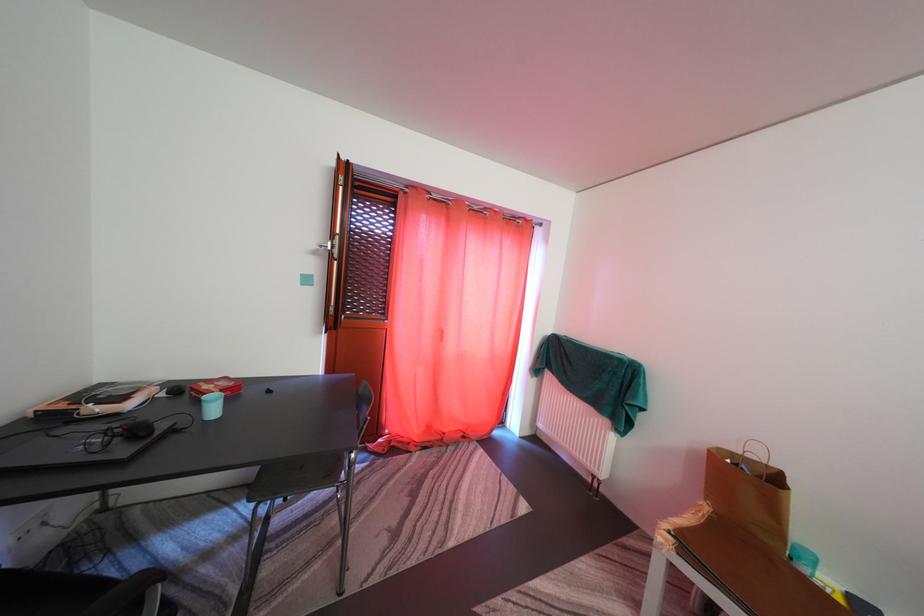
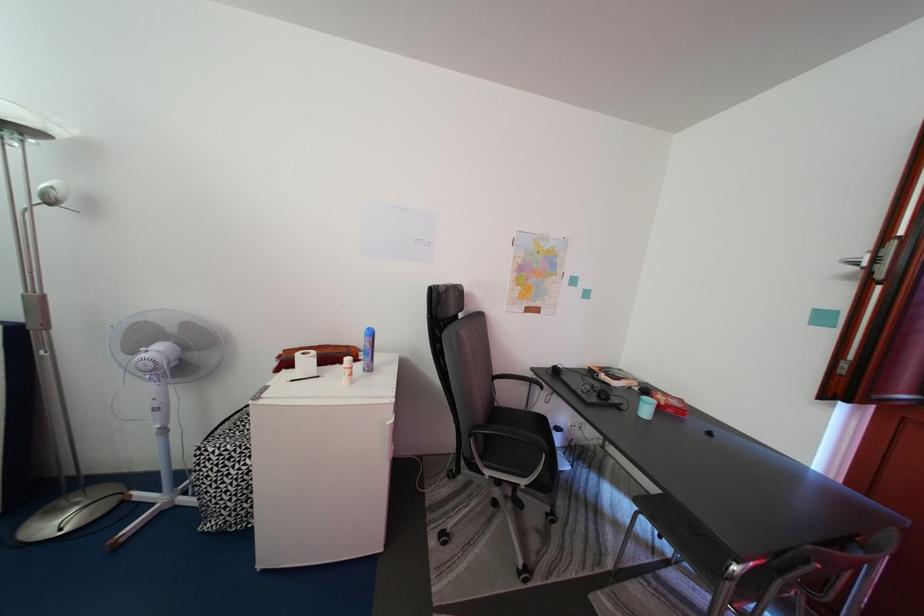
Question: The camera is either moving clockwise (left) or counter-clockwise (right) around the object. The first image is from the beginning of the video and the second image is from the end. Is the camera moving left or right when shooting the video?

Choices:
 (A) Left
 (B) Right

Answer: (B)